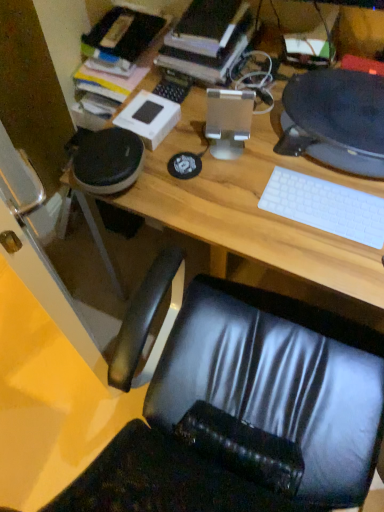
Question: From the image's perspective, is white matte keyboard at right over hardcover book at upper center?

Choices:
 (A) no
 (B) yes

Answer: (A)

Question: Can you confirm if white matte keyboard at right is thinner than hardcover book at upper center?

Choices:
 (A) yes
 (B) no

Answer: (A)

Question: Is white matte keyboard at right at the right side of hardcover book at upper center?

Choices:
 (A) yes
 (B) no

Answer: (A)

Question: From a real-world perspective, is white matte keyboard at right located beneath hardcover book at upper center?

Choices:
 (A) yes
 (B) no

Answer: (A)

Question: Is white matte keyboard at right positioned beyond the bounds of hardcover book at upper center?

Choices:
 (A) yes
 (B) no

Answer: (A)

Question: Is white matte keyboard at right shorter than hardcover book at upper center?

Choices:
 (A) yes
 (B) no

Answer: (A)

Question: Can you confirm if white matte keyboard at right is wider than matte black desktop computer at upper right, which ranks as the second desktop computer in left-to-right order?

Choices:
 (A) yes
 (B) no

Answer: (B)

Question: Is white matte keyboard at right not within matte black desktop computer at upper right, which appears as the first desktop computer when viewed from the right?

Choices:
 (A) yes
 (B) no

Answer: (A)

Question: Is white matte keyboard at right taller than matte black desktop computer at upper right, which appears as the first desktop computer when viewed from the right?

Choices:
 (A) yes
 (B) no

Answer: (B)

Question: From the image's perspective, is white matte keyboard at right below matte black desktop computer at upper right, which appears as the first desktop computer when viewed from the right?

Choices:
 (A) no
 (B) yes

Answer: (B)

Question: Is white matte keyboard at right positioned far away from matte black desktop computer at upper right, which ranks as the second desktop computer in left-to-right order?

Choices:
 (A) yes
 (B) no

Answer: (B)

Question: Can you confirm if white matte keyboard at right is smaller than matte black desktop computer at upper right, which ranks as the second desktop computer in left-to-right order?

Choices:
 (A) yes
 (B) no

Answer: (A)

Question: Is satin silver desktop computer at center, which is the 2th desktop computer from right to left, facing towards matte black desktop computer at upper right, which appears as the first desktop computer when viewed from the right?

Choices:
 (A) no
 (B) yes

Answer: (A)